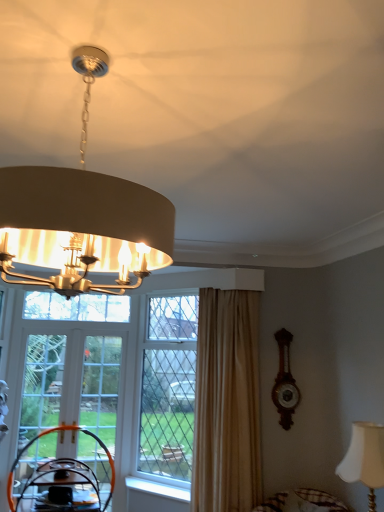
Find the location of a particular element. Image resolution: width=384 pixels, height=512 pixels. clear glass window at center is located at coordinates (168, 387).

Describe the element at coordinates (168, 387) in the screenshot. I see `clear glass window at center` at that location.

Image resolution: width=384 pixels, height=512 pixels. Find the location of `white painted wood at lower center`. white painted wood at lower center is located at coordinates (156, 489).

What do you see at coordinates (227, 403) in the screenshot?
I see `beige fabric curtain at right` at bounding box center [227, 403].

Consider the image. What is the approximate height of matte beige lampshade at upper center, the 2th lamp when ordered from back to front?

The height of matte beige lampshade at upper center, the 2th lamp when ordered from back to front, is 77.41 centimeters.

Measure the distance between clear glass screen door at center, placed as the second screen door when sorted from left to right, and camera.

clear glass screen door at center, placed as the second screen door when sorted from left to right, and camera are 4.16 meters apart from each other.

Identify the location of orange plastic swivel chair at lower left. (62, 480).

In order to click on swivel chair that appears below the clear glass screen door at center, which is the 1th screen door in right-to-left order (from the image's perspective) in this screenshot , I will do `click(62, 480)`.

From the image's perspective, is orange plastic swivel chair at lower left on clear glass screen door at center, which is the 1th screen door in right-to-left order?

No.

Does orange plastic swivel chair at lower left lie behind clear glass screen door at center, placed as the second screen door when sorted from left to right?

No, orange plastic swivel chair at lower left is closer to the camera.

Can you tell me how much clear glass door at lower left, the first screen door from the left, and matte beige lampshade at upper center, the 2th lamp when ordered from right to left, differ in facing direction?

They differ by 88.7 degrees in their facing directions.

Is matte beige lampshade at upper center, the first lamp viewed from the top, at the back of clear glass door at lower left, which is the 2th screen door from right to left?

No.

Choose the correct answer: Is clear glass door at lower left, which is the 2th screen door from right to left, inside matte beige lampshade at upper center, the first lamp viewed from the top, or outside it?

clear glass door at lower left, which is the 2th screen door from right to left, exists outside the volume of matte beige lampshade at upper center, the first lamp viewed from the top.

Considering the positions of point (107, 475) and point (77, 261), is point (107, 475) closer or farther from the camera than point (77, 261)?

Point (107, 475) is positioned farther from the camera compared to point (77, 261).

From the image's perspective, does white fabric lampshade at lower right, which ranks as the 1th lamp in back-to-front order, appear higher than wooden round table at lower left?

Yes, from the image's perspective, white fabric lampshade at lower right, which ranks as the 1th lamp in back-to-front order, is over wooden round table at lower left.

Which object is wider, white fabric lampshade at lower right, which ranks as the 1th lamp in back-to-front order, or wooden round table at lower left?

With larger width is wooden round table at lower left.

Which is more to the right, white fabric lampshade at lower right, the second lamp from the front, or wooden round table at lower left?

From the viewer's perspective, white fabric lampshade at lower right, the second lamp from the front, appears more on the right side.

Is point (366, 428) closer to viewer compared to point (46, 493)?

Yes, it is in front of point (46, 493).

From their relative heights in the image, would you say clear glass window at center is taller or shorter than clear glass screen door at center, placed as the second screen door when sorted from left to right?

In the image, clear glass window at center appears to be taller than clear glass screen door at center, placed as the second screen door when sorted from left to right.

From the image's perspective, who appears lower, clear glass window at center or clear glass screen door at center, placed as the second screen door when sorted from left to right?

clear glass screen door at center, placed as the second screen door when sorted from left to right, from the image's perspective.

Considering the relative sizes of clear glass window at center and clear glass screen door at center, placed as the second screen door when sorted from left to right, in the image provided, is clear glass window at center smaller than clear glass screen door at center, placed as the second screen door when sorted from left to right,?

No, clear glass window at center is not smaller than clear glass screen door at center, placed as the second screen door when sorted from left to right.

Considering the relative positions of clear glass window at center and clear glass screen door at center, which is the 1th screen door in right-to-left order, in the image provided, is clear glass window at center to the left or to the right of clear glass screen door at center, which is the 1th screen door in right-to-left order,?

Clearly, clear glass window at center is on the right of clear glass screen door at center, which is the 1th screen door in right-to-left order, in the image.

From the image's perspective, relative to wooden round table at lower left, is beige fabric curtain at right above or below?

Clearly, from the image's perspective, beige fabric curtain at right is above wooden round table at lower left.

In the scene shown: Which is closer, (x=234, y=335) or (x=83, y=465)?

Point (x=234, y=335).

In the scene shown: Which object is positioned more to the left, beige fabric curtain at right or wooden round table at lower left?

From the viewer's perspective, wooden round table at lower left appears more on the left side.

Looking at their sizes, would you say wooden clock at right is wider or thinner than orange plastic swivel chair at lower left?

wooden clock at right is wider than orange plastic swivel chair at lower left.

Is wooden clock at right facing towards orange plastic swivel chair at lower left?

No, wooden clock at right is not facing towards orange plastic swivel chair at lower left.

Measure the distance from wooden clock at right to orange plastic swivel chair at lower left.

wooden clock at right is 6.53 feet from orange plastic swivel chair at lower left.

Would you consider wooden clock at right to be distant from orange plastic swivel chair at lower left?

Absolutely, wooden clock at right is distant from orange plastic swivel chair at lower left.

Is orange plastic swivel chair at lower left oriented away from wooden round table at lower left?

Yes.

Which of these two, orange plastic swivel chair at lower left or wooden round table at lower left, is wider?

wooden round table at lower left is wider.

Considering the relative sizes of orange plastic swivel chair at lower left and wooden round table at lower left in the image provided, is orange plastic swivel chair at lower left bigger than wooden round table at lower left?

No.

What's the angular difference between orange plastic swivel chair at lower left and wooden round table at lower left's facing directions?

They differ by 0.835 degrees in their facing directions.

The height and width of the screenshot is (512, 384). I want to click on the 2nd screen door to the right when counting from the orange plastic swivel chair at lower left, so click(x=101, y=387).

Starting from the clear glass door at lower left, the first screen door from the left, which lamp is the 2nd one in front? Please provide its 2D coordinates.

[(81, 228)]

Based on their spatial positions, is matte beige lampshade at upper center, the 2th lamp from the bottom, or clear glass screen door at center, which is the 1th screen door in right-to-left order, closer to wooden clock at right?

clear glass screen door at center, which is the 1th screen door in right-to-left order.

From the image, which object appears to be farther from orange plastic swivel chair at lower left, clear glass door at lower left, which is the 2th screen door from right to left, or matte beige lampshade at upper center, the 1th lamp from the front?

Among the two, matte beige lampshade at upper center, the 1th lamp from the front, is located further to orange plastic swivel chair at lower left.

In the scene shown: Looking at the image, which one is located further to white fabric lampshade at lower right, which is the second lamp from top to bottom, matte beige lampshade at upper center, the 1th lamp from the front, or wooden clock at right?

matte beige lampshade at upper center, the 1th lamp from the front.

Which object lies further to the anchor point matte beige lampshade at upper center, the 2th lamp from the bottom, beige fabric curtain at right or wooden clock at right?

wooden clock at right lies further to matte beige lampshade at upper center, the 2th lamp from the bottom, than the other object.

Based on their spatial positions, is matte beige lampshade at upper center, the 2th lamp when ordered from right to left, or white fabric lampshade at lower right, which is the second lamp from left to right, closer to clear glass door at lower left, the first screen door from the left?

Among the two, matte beige lampshade at upper center, the 2th lamp when ordered from right to left, is located nearer to clear glass door at lower left, the first screen door from the left.

Which object lies further to the anchor point clear glass screen door at center, placed as the second screen door when sorted from left to right, wooden clock at right or wooden round table at lower left?

wooden clock at right is positioned further to the anchor clear glass screen door at center, placed as the second screen door when sorted from left to right.

Looking at the image, which one is located closer to clear glass window at center, wooden clock at right or clear glass door at lower left, which is the 2th screen door from right to left?

clear glass door at lower left, which is the 2th screen door from right to left, lies closer to clear glass window at center than the other object.

From the image, which object appears to be farther from clear glass window at center, clear glass door at lower left, the first screen door from the left, or clear glass screen door at center, which is the 1th screen door in right-to-left order?

Based on the image, clear glass door at lower left, the first screen door from the left, appears to be further to clear glass window at center.

The width and height of the screenshot is (384, 512). Find the location of `curtain between clear glass window at center and wooden clock at right`. curtain between clear glass window at center and wooden clock at right is located at coordinates (227, 403).

Where is `window sill positioned between matte beige lampshade at upper center, the 2th lamp when ordered from right to left, and orange plastic swivel chair at lower left from near to far`? Image resolution: width=384 pixels, height=512 pixels. window sill positioned between matte beige lampshade at upper center, the 2th lamp when ordered from right to left, and orange plastic swivel chair at lower left from near to far is located at coordinates (156, 489).

In order to click on screen door positioned between matte beige lampshade at upper center, the 1th lamp from the front, and clear glass screen door at center, which is the 1th screen door in right-to-left order, from near to far in this screenshot , I will do (71, 384).

What are the coordinates of `round table between matte beige lampshade at upper center, the first lamp viewed from the top, and white painted wood at lower center in the front-back direction` in the screenshot? It's located at (61, 488).